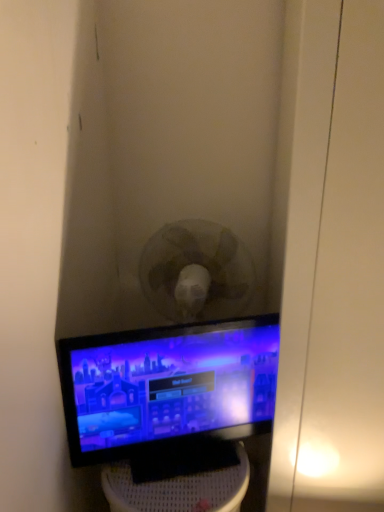
Question: From the image's perspective, is matte black monitor at center located above or below black matte monitor at center?

Choices:
 (A) above
 (B) below

Answer: (A)

Question: Would you say matte black monitor at center is to the left or to the right of black matte monitor at center in the picture?

Choices:
 (A) left
 (B) right

Answer: (B)

Question: Is matte black monitor at center in front of or behind black matte monitor at center in the image?

Choices:
 (A) behind
 (B) front

Answer: (A)

Question: Looking at the image, does black matte monitor at center seem bigger or smaller compared to matte black monitor at center?

Choices:
 (A) big
 (B) small

Answer: (A)

Question: Is point (238, 485) closer or farther from the camera than point (208, 357)?

Choices:
 (A) farther
 (B) closer

Answer: (B)

Question: From the image's perspective, relative to matte black monitor at center, is black matte monitor at center above or below?

Choices:
 (A) below
 (B) above

Answer: (A)

Question: In the image, is black matte monitor at center on the left side or the right side of matte black monitor at center?

Choices:
 (A) right
 (B) left

Answer: (B)